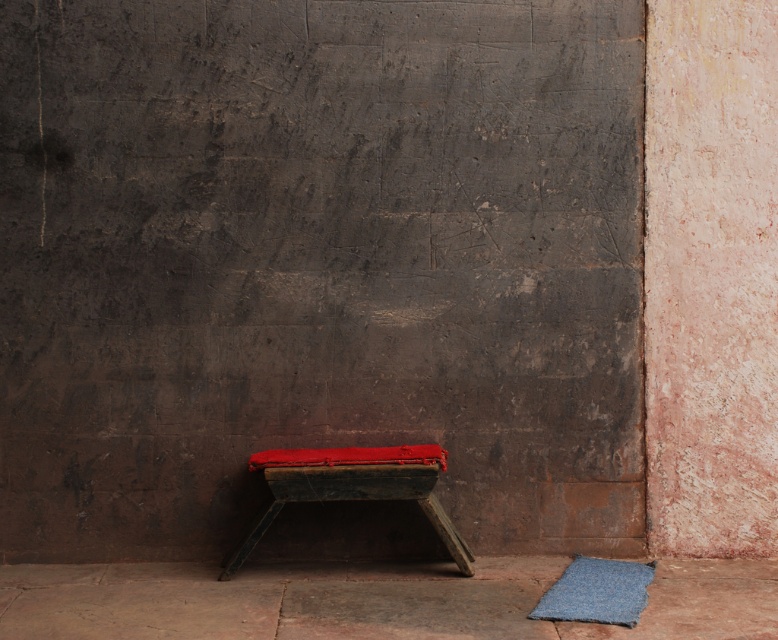
Between red leather stool at center and blue felt mat at lower right, which one appears on the right side from the viewer's perspective?

blue felt mat at lower right is more to the right.

Does red leather stool at center have a greater width compared to blue felt mat at lower right?

Yes, red leather stool at center is wider than blue felt mat at lower right.

Which is behind, point (352, 472) or point (626, 602)?

Point (352, 472)

Locate an element on the screen. red leather stool at center is located at coordinates (352, 486).